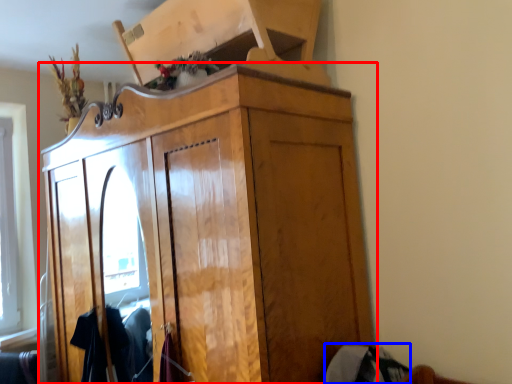
Question: Which object appears closest to the camera in this image, cupboard (highlighted by a red box) or clothing (highlighted by a blue box)?

Choices:
 (A) cupboard
 (B) clothing

Answer: (A)